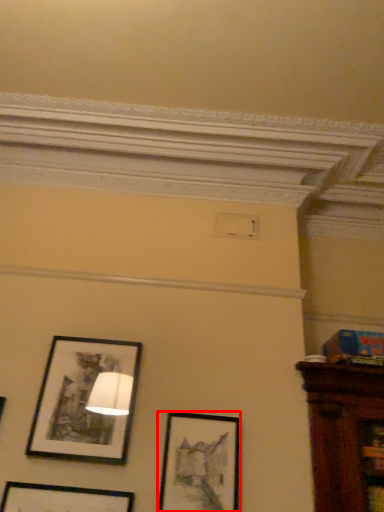
Question: From the image's perspective, where is picture frame (annotated by the red box) located in relation to picture frame in the image?

Choices:
 (A) above
 (B) below

Answer: (B)